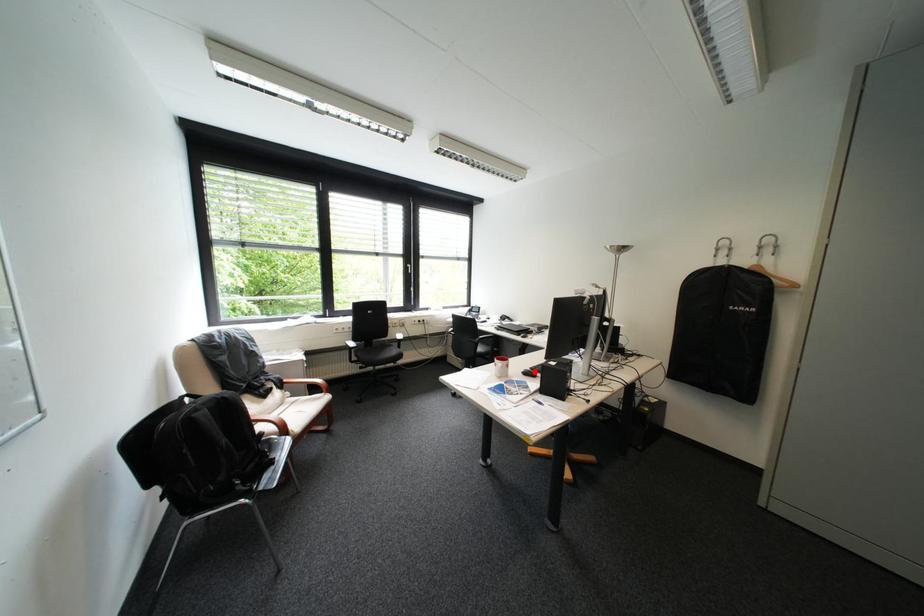
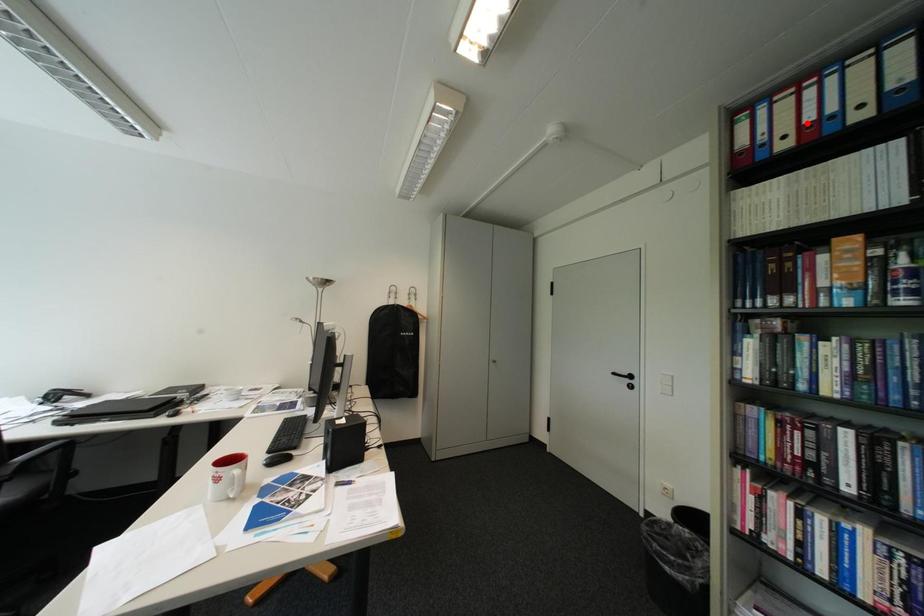
I am providing you with two images of the same scene from different viewpoints. A red point is marked on the first image and another point is marked on the second image. Is the red point in image1 aligned with the point shown in image2?

No